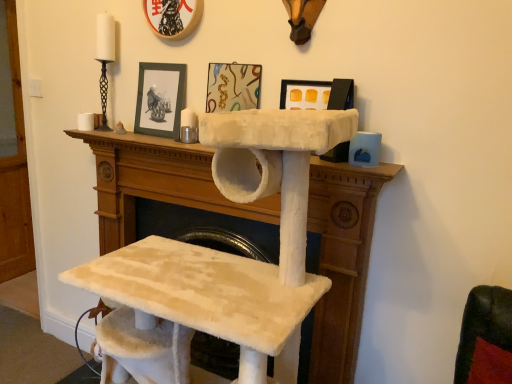
Question: Which is correct: matte plastic picture frame at upper center, which is the second picture frame from left to right, is inside matte black picture frame at upper center, which is the third picture frame in left-to-right order, or outside of it?

Choices:
 (A) inside
 (B) outside

Answer: (B)

Question: From the image's perspective, relative to matte black picture frame at upper center, which is the third picture frame in left-to-right order, is matte plastic picture frame at upper center, which is the second picture frame from left to right, above or below?

Choices:
 (A) below
 (B) above

Answer: (B)

Question: Considering the real-world distances, which object is closest to the white fluffy cat tree at center?

Choices:
 (A) black matte picture frame at upper center, positioned as the 3th picture frame in right-to-left order
 (B) matte black picture frame at upper center, which is counted as the first picture frame, starting from the right
 (C) matte plastic picture frame at upper center, which ranks as the second picture frame in right-to-left order

Answer: (A)

Question: Estimate the real-world distances between objects in this image. Which object is farther from the matte black picture frame at upper center, which is counted as the first picture frame, starting from the right?

Choices:
 (A) white fluffy cat tree at center
 (B) black matte picture frame at upper center, the 1th picture frame from the left
 (C) matte plastic picture frame at upper center, which is the second picture frame from left to right

Answer: (B)